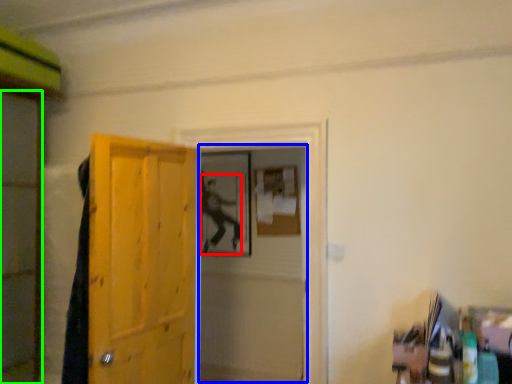
Question: Which is nearer to the person (highlighted by a red box)? screen door (highlighted by a blue box) or screen door (highlighted by a green box).

Choices:
 (A) screen door
 (B) screen door

Answer: (A)